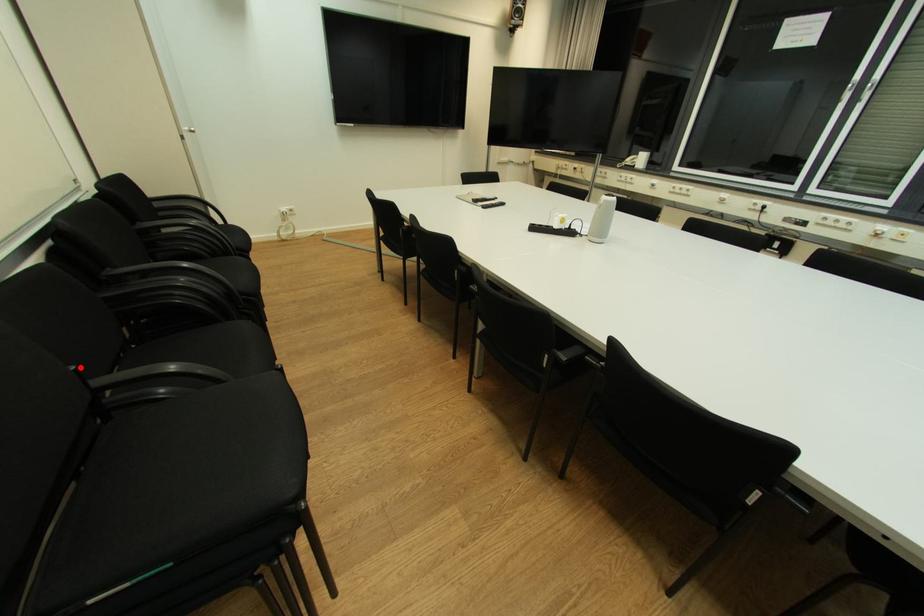
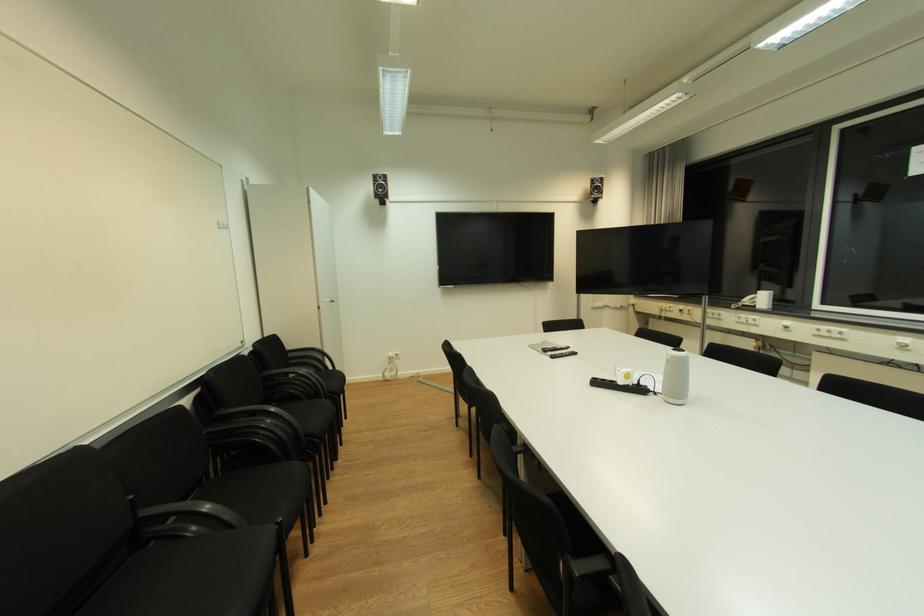
In the second image, find the point that corresponds to the highlighted location in the first image.

(137, 498)